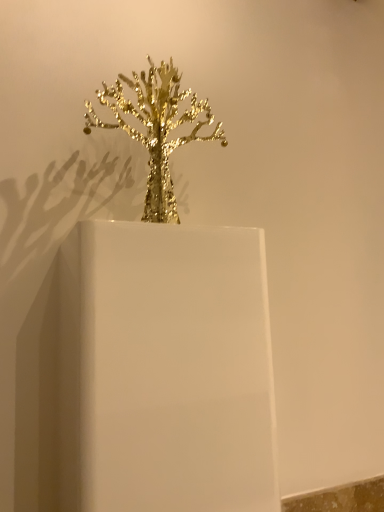
Question: From a real-world perspective, is white glossy candle holder at center on top of gold metallic tree at center?

Choices:
 (A) yes
 (B) no

Answer: (B)

Question: Can you confirm if white glossy candle holder at center is shorter than gold metallic tree at center?

Choices:
 (A) no
 (B) yes

Answer: (A)

Question: Is white glossy candle holder at center touching gold metallic tree at center?

Choices:
 (A) yes
 (B) no

Answer: (B)

Question: From the image's perspective, is white glossy candle holder at center located above gold metallic tree at center?

Choices:
 (A) yes
 (B) no

Answer: (B)

Question: Is gold metallic tree at center at the back of white glossy candle holder at center?

Choices:
 (A) no
 (B) yes

Answer: (A)

Question: Does white glossy candle holder at center come in front of gold metallic tree at center?

Choices:
 (A) no
 (B) yes

Answer: (B)

Question: Is white glossy candle holder at center a part of gold metallic tree at center?

Choices:
 (A) yes
 (B) no

Answer: (B)

Question: Considering the relative sizes of gold metallic tree at center and white glossy candle holder at center in the image provided, is gold metallic tree at center thinner than white glossy candle holder at center?

Choices:
 (A) yes
 (B) no

Answer: (A)

Question: Considering the relative positions of gold metallic tree at center and white glossy candle holder at center in the image provided, is gold metallic tree at center in front of white glossy candle holder at center?

Choices:
 (A) yes
 (B) no

Answer: (B)

Question: From a real-world perspective, is gold metallic tree at center under white glossy candle holder at center?

Choices:
 (A) yes
 (B) no

Answer: (B)

Question: Does gold metallic tree at center have a lesser height compared to white glossy candle holder at center?

Choices:
 (A) no
 (B) yes

Answer: (B)

Question: Is gold metallic tree at center taller than white glossy candle holder at center?

Choices:
 (A) yes
 (B) no

Answer: (B)

Question: From the image's perspective, is gold metallic tree at center above or below white glossy candle holder at center?

Choices:
 (A) above
 (B) below

Answer: (A)